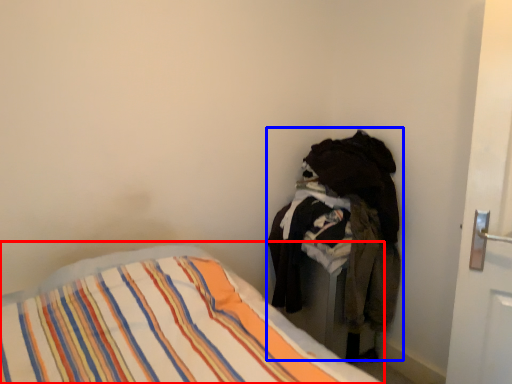
Question: Among these objects, which one is farthest to the camera, bed (highlighted by a red box) or laundry (highlighted by a blue box)?

Choices:
 (A) bed
 (B) laundry

Answer: (B)